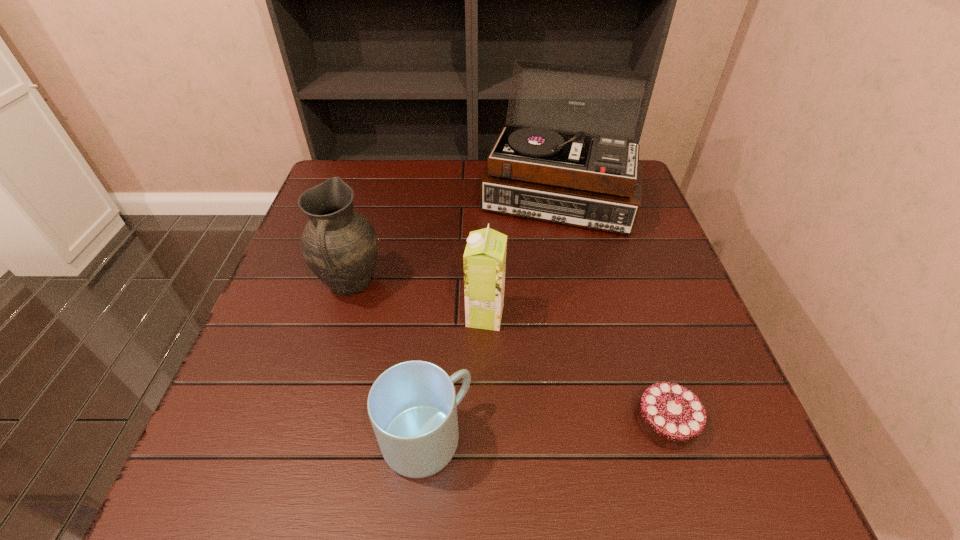
The height and width of the screenshot is (540, 960). I want to click on the tallest object, so click(545, 165).

Image resolution: width=960 pixels, height=540 pixels. Identify the location of the farthest object. (545, 165).

Where is `the leftmost object`? the leftmost object is located at coordinates (340, 246).

Image resolution: width=960 pixels, height=540 pixels. In order to click on soya milk in this screenshot , I will do `click(484, 260)`.

I want to click on the second shortest object, so click(x=412, y=406).

Locate an element on the screen. This screenshot has height=540, width=960. chocolate cake is located at coordinates (670, 415).

The width and height of the screenshot is (960, 540). In order to click on vacant space located 0.220m on the front of the farthest object in this screenshot , I will do `click(581, 305)`.

Locate an element on the screen. The height and width of the screenshot is (540, 960). vacant space located on the side of the pitcher with the handle is located at coordinates (314, 410).

Find the location of a particular element. This screenshot has width=960, height=540. free spot located 0.060m on the front of the soya milk is located at coordinates (486, 355).

The image size is (960, 540). I want to click on vacant point located on the right of the mug, so click(x=651, y=439).